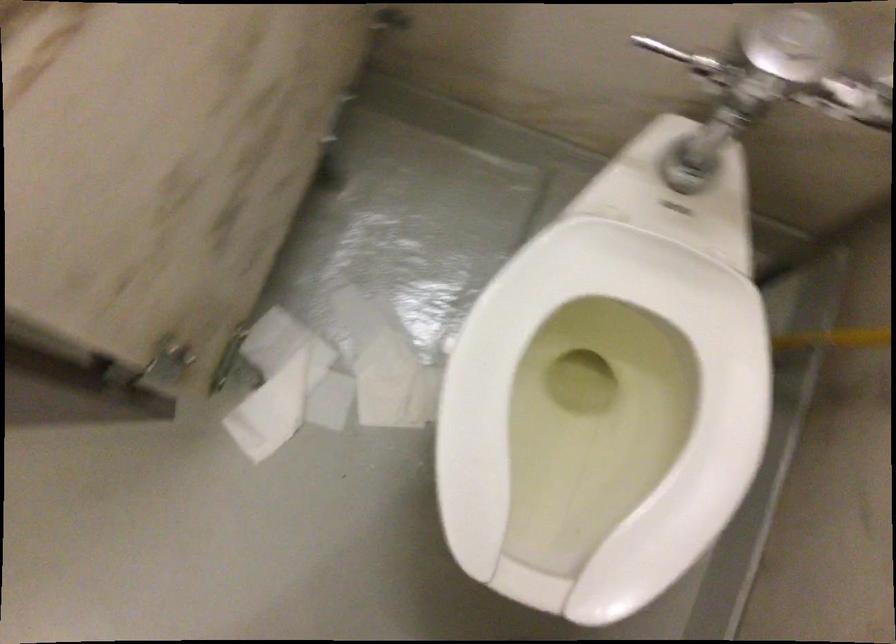
Describe the element at coordinates (600, 415) in the screenshot. I see `a white toilet seat` at that location.